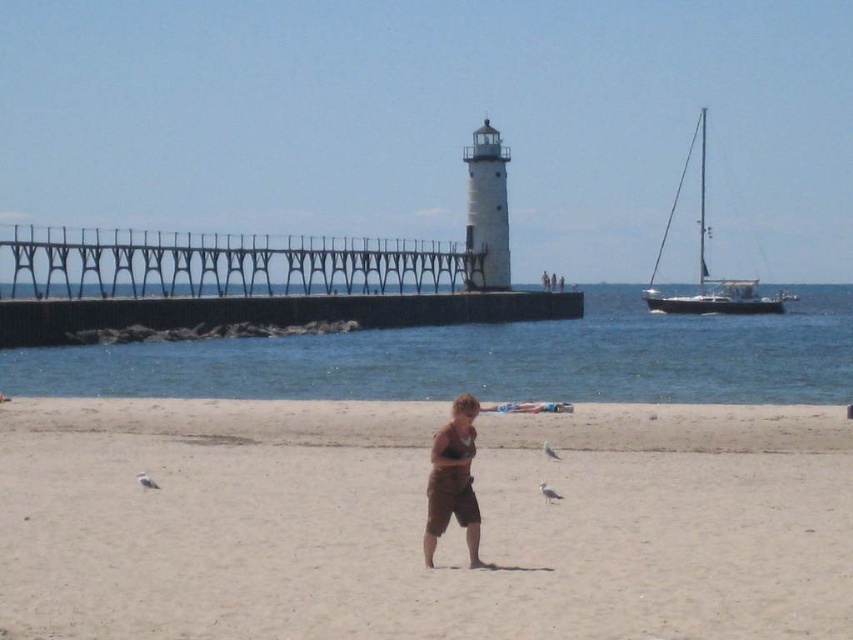
Is dark gray concrete pier at center bigger than brown cotton shorts at center?

Yes.

Does point (370, 301) come farther from viewer compared to point (479, 410)?

Yes, it is.

Between point (398, 323) and point (467, 419), which one is positioned in front?

Point (467, 419) is in front.

Locate an element on the screen. This screenshot has height=640, width=853. dark gray concrete pier at center is located at coordinates (270, 314).

Is brown cotton shorts at center thinner than white sailboat at right?

Yes, brown cotton shorts at center is thinner than white sailboat at right.

Which is behind, point (450, 499) or point (772, 307)?

The point (772, 307) is behind.

Find the location of a particular element. brown cotton shorts at center is located at coordinates [x=453, y=481].

I want to click on brown cotton shorts at center, so click(x=453, y=481).

The width and height of the screenshot is (853, 640). What do you see at coordinates (486, 358) in the screenshot?
I see `blue water at center` at bounding box center [486, 358].

Can you confirm if blue water at center is positioned to the right of white sailboat at right?

In fact, blue water at center is to the left of white sailboat at right.

The height and width of the screenshot is (640, 853). I want to click on blue water at center, so click(x=486, y=358).

At what (x,y) coordinates should I click in order to perform the action: click on blue water at center. Please return your answer as a coordinate pair (x, y). This screenshot has height=640, width=853. Looking at the image, I should click on (486, 358).